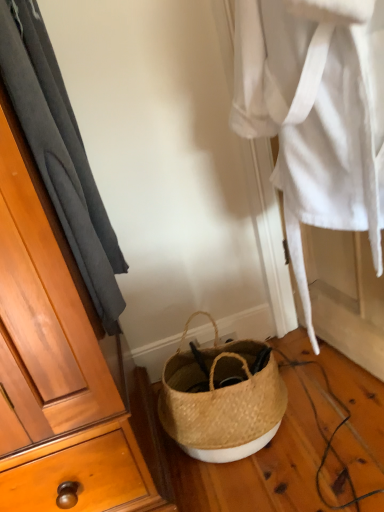
Question: From a real-world perspective, is dark gray fabric at left located higher than white woven robe at center?

Choices:
 (A) no
 (B) yes

Answer: (B)

Question: Is dark gray fabric at left facing away from white woven robe at center?

Choices:
 (A) no
 (B) yes

Answer: (A)

Question: Is dark gray fabric at left to the right of white woven robe at center from the viewer's perspective?

Choices:
 (A) yes
 (B) no

Answer: (B)

Question: Could you tell me if dark gray fabric at left is facing white woven robe at center?

Choices:
 (A) yes
 (B) no

Answer: (A)

Question: Considering the relative positions of dark gray fabric at left and white woven robe at center in the image provided, is dark gray fabric at left in front of white woven robe at center?

Choices:
 (A) yes
 (B) no

Answer: (A)

Question: From a real-world perspective, is dark gray fabric at left positioned under white woven robe at center based on gravity?

Choices:
 (A) yes
 (B) no

Answer: (B)

Question: Can you confirm if natural woven basket at lower center is positioned to the right of dark gray fabric at left?

Choices:
 (A) no
 (B) yes

Answer: (B)

Question: From the image's perspective, does natural woven basket at lower center appear lower than dark gray fabric at left?

Choices:
 (A) yes
 (B) no

Answer: (A)

Question: Does natural woven basket at lower center have a smaller size compared to dark gray fabric at left?

Choices:
 (A) yes
 (B) no

Answer: (A)

Question: Does natural woven basket at lower center have a greater width compared to dark gray fabric at left?

Choices:
 (A) yes
 (B) no

Answer: (A)

Question: Is natural woven basket at lower center far away from dark gray fabric at left?

Choices:
 (A) no
 (B) yes

Answer: (A)

Question: Is dark gray fabric at left inside natural woven basket at lower center?

Choices:
 (A) no
 (B) yes

Answer: (A)

Question: Is white woven robe at center facing towards natural woven basket at lower center?

Choices:
 (A) yes
 (B) no

Answer: (A)